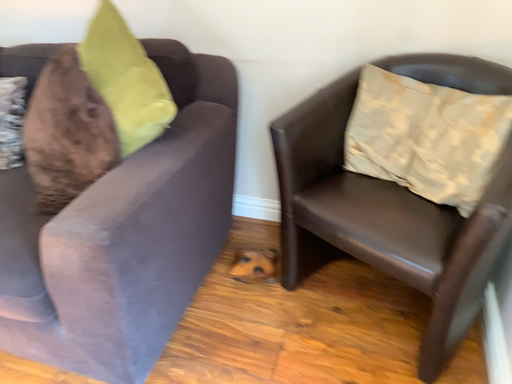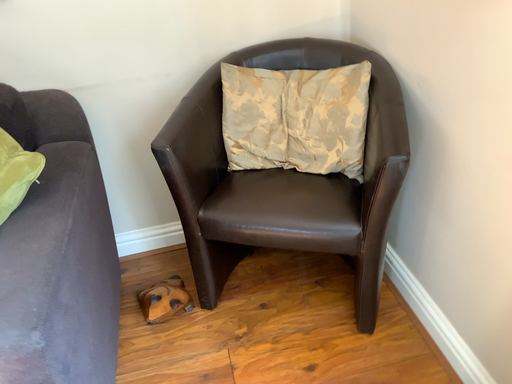
Question: Which way did the camera rotate in the video?

Choices:
 (A) rotated right
 (B) rotated left

Answer: (A)